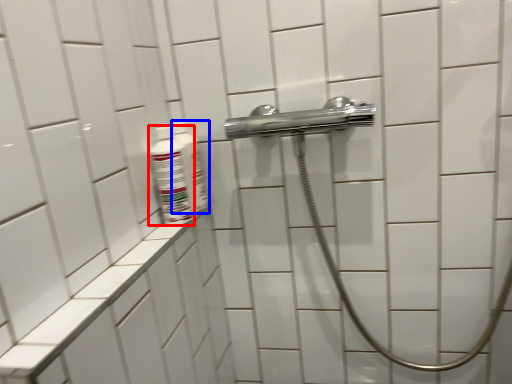
Question: Which object is further to the camera taking this photo, mouthwash (highlighted by a red box) or mouthwash (highlighted by a blue box)?

Choices:
 (A) mouthwash
 (B) mouthwash

Answer: (B)